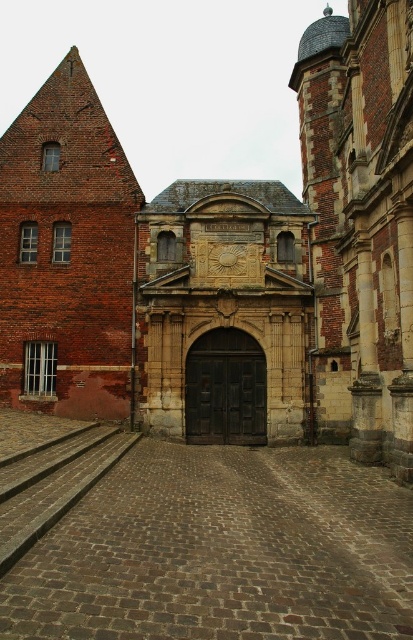
You are a train engineer approaching the historic building. You need to stop your train before the brown cobblestone train track at center and the brick wall at left. Which one will you stop at first?

The brown cobblestone train track at center occupies less space than the brick wall at left, so you should stop before the brown cobblestone train track at center first because it is closer to the train.